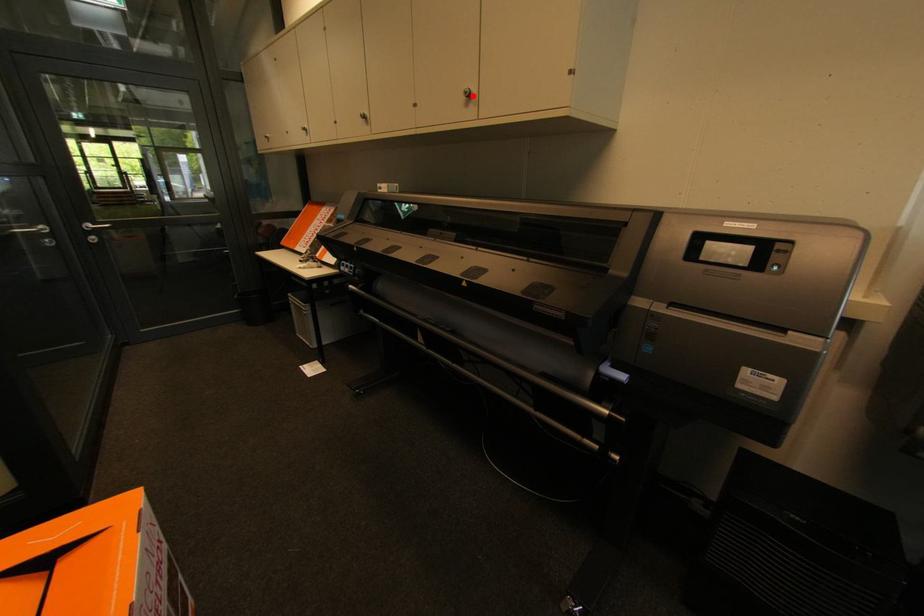
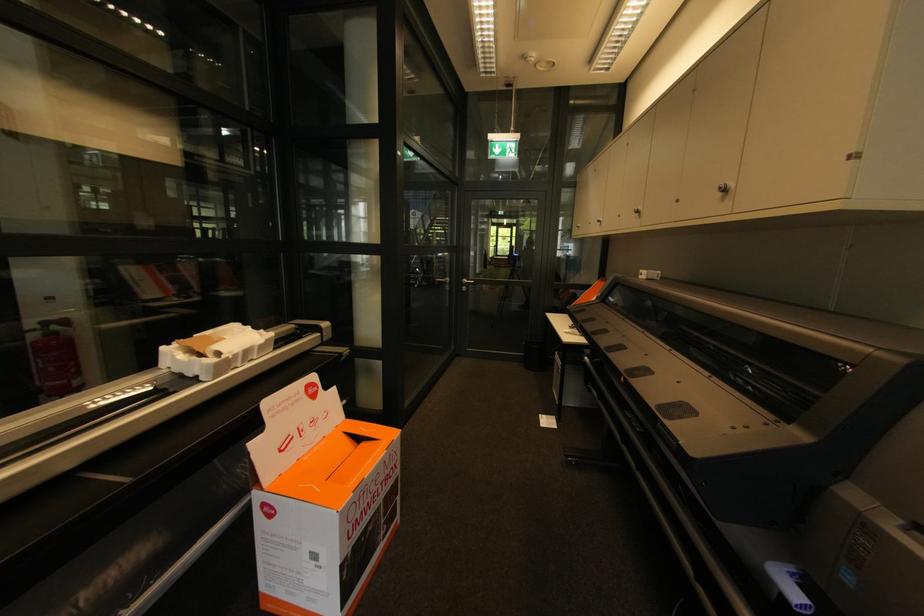
Find the pixel in the second image that matches the highlighted location in the first image.

(727, 191)